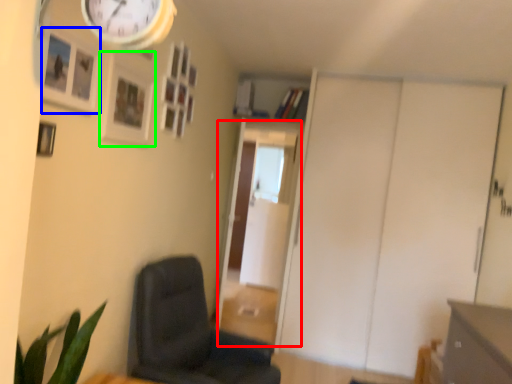
Question: Which object is positioned closest to glass door (highlighted by a red box)? Select from picture frame (highlighted by a blue box) and picture frame (highlighted by a green box).

Choices:
 (A) picture frame
 (B) picture frame

Answer: (B)